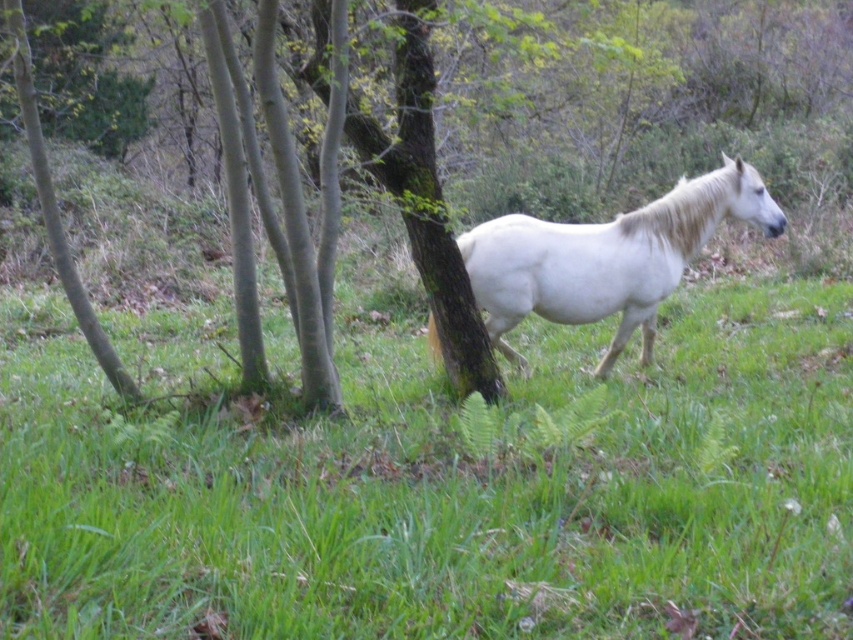
Does brown rough tree at center appear on the right side of white matte horse at center?

In fact, brown rough tree at center is to the left of white matte horse at center.

Which of these two, brown rough tree at center or white matte horse at center, stands shorter?

Standing shorter between the two is white matte horse at center.

The height and width of the screenshot is (640, 853). Find the location of `brown rough tree at center`. brown rough tree at center is located at coordinates (512, 189).

Is point (578, 392) in front of point (509, 356)?

Yes, point (578, 392) is closer to viewer.

Is green grass at center positioned behind white matte horse at center?

No, green grass at center is closer to the viewer.

This screenshot has height=640, width=853. I want to click on green grass at center, so click(x=437, y=484).

You are a GUI agent. You are given a task and a screenshot of the screen. Output one action in this format:
    pyautogui.click(x=<x>, y=<y>)
    Task: Click on the green grass at center
    The height and width of the screenshot is (640, 853).
    Given the screenshot: What is the action you would take?
    pyautogui.click(x=437, y=484)

Who is taller, green grass at center or brown rough tree at center?

With more height is brown rough tree at center.

Which is more to the right, green grass at center or brown rough tree at center?

Positioned to the right is brown rough tree at center.

Is point (212, 348) positioned after point (624, 112)?

No, (212, 348) is closer to viewer.

Identify the location of green grass at center. (437, 484).